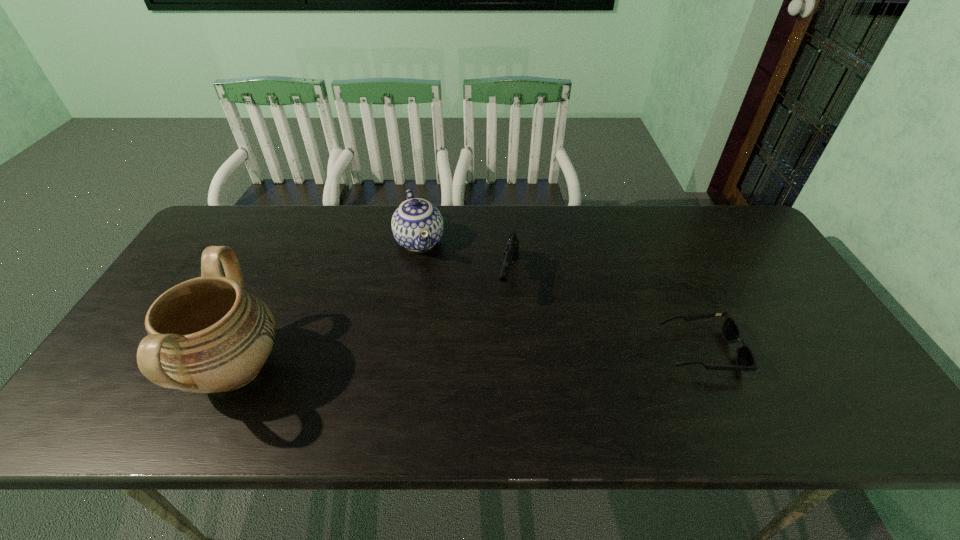
Where is `free space on the desktop that is between the urn and the rightmost object and is positioned at the end of the barrel of the second shortest object`? The image size is (960, 540). free space on the desktop that is between the urn and the rightmost object and is positioned at the end of the barrel of the second shortest object is located at coordinates (490, 359).

Identify the location of free space on the desktop that is between the tallest object and the sunglasses and is positioned at the spout of the third shortest object. (460, 360).